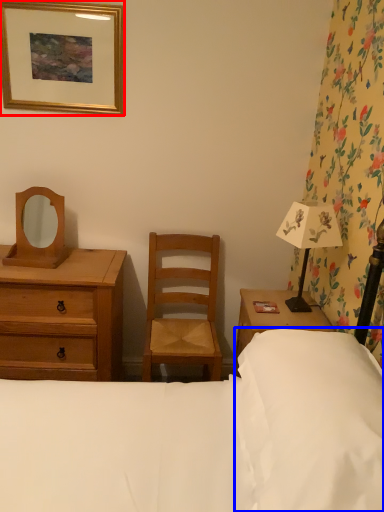
Question: Which of the following is the farthest to the observer, picture frame (highlighted by a red box) or pillow (highlighted by a blue box)?

Choices:
 (A) picture frame
 (B) pillow

Answer: (A)